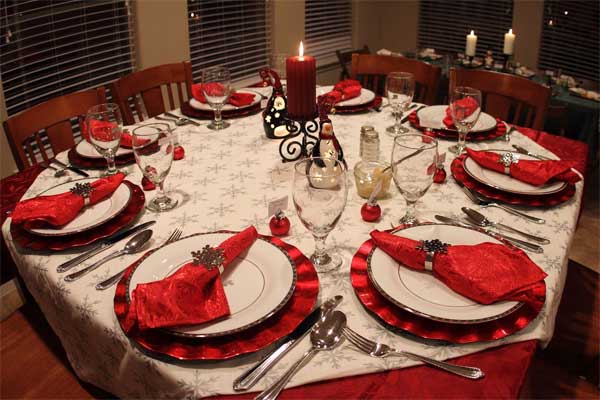
In order to click on white plates in this screenshot , I will do `click(280, 293)`, `click(434, 275)`, `click(500, 173)`, `click(433, 109)`, `click(356, 97)`, `click(226, 107)`, `click(97, 152)`, `click(102, 202)`.